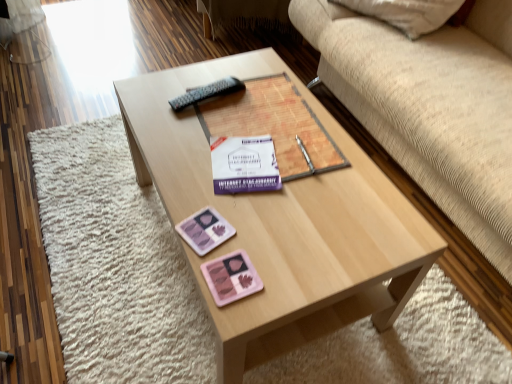
What are the coordinates of `empty space that is in between purple matte book at center and pink matte eyeshadow palette at center, arranged as the 1th currency when viewed from the top` in the screenshot? It's located at (227, 190).